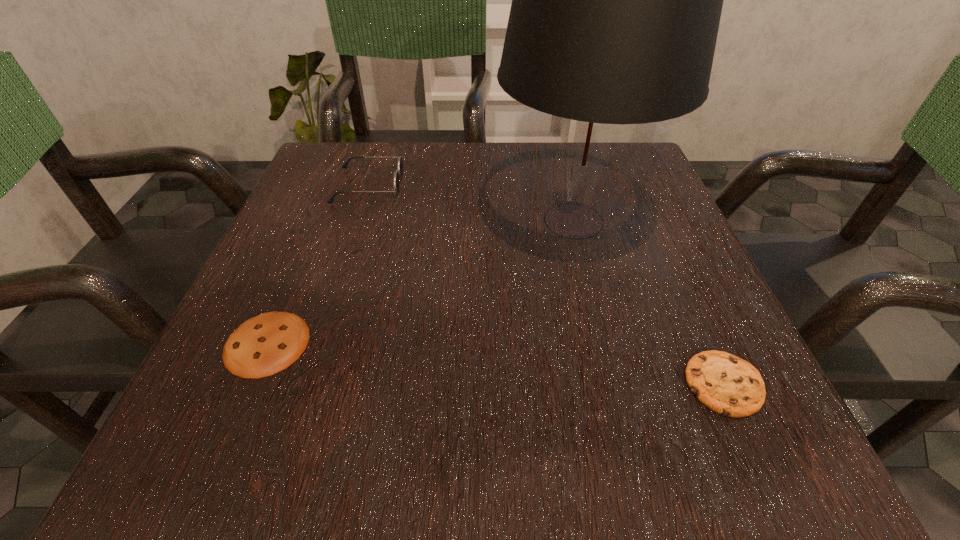
The width and height of the screenshot is (960, 540). In order to click on object that is at the near edge in this screenshot , I will do `click(726, 384)`.

Identify the location of sunglasses that is at the left edge. (398, 174).

Identify the location of cookie that is at the left edge. (266, 344).

At what (x,y) coordinates should I click in order to perform the action: click on lampshade that is at the right edge. Please return your answer as a coordinate pair (x, y). This screenshot has width=960, height=540. Looking at the image, I should click on (616, 0).

Where is `cookie at the right edge`? cookie at the right edge is located at coordinates pyautogui.click(x=726, y=384).

Where is `object situated at the far left corner`? object situated at the far left corner is located at coordinates (398, 174).

Find the location of `object that is positioned at the far right corner`. object that is positioned at the far right corner is located at coordinates (616, 0).

Find the location of a particular element. This screenshot has width=960, height=540. object present at the near right corner is located at coordinates (726, 384).

Locate an element on the screen. free region at the far edge is located at coordinates (446, 201).

Identify the location of vacant area at the left edge of the desktop. (264, 382).